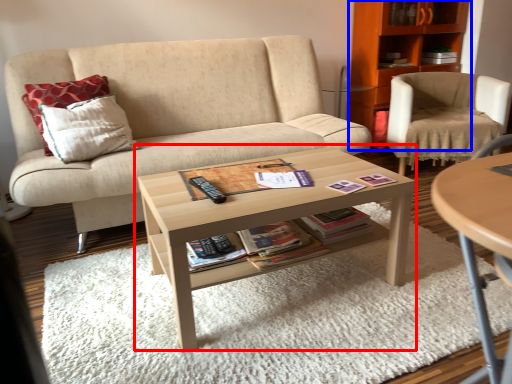
Question: Which point is further to the camera, coffee table (highlighted by a red box) or cabinetry (highlighted by a blue box)?

Choices:
 (A) coffee table
 (B) cabinetry

Answer: (B)